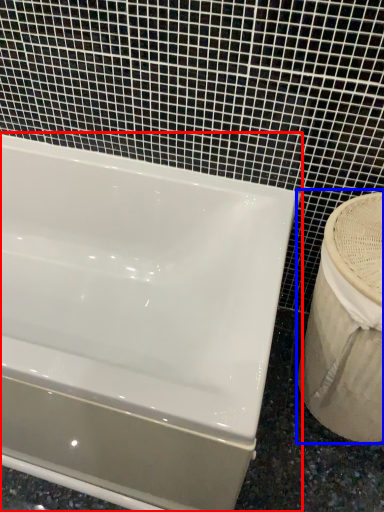
Question: Which object is closer to the camera taking this photo, bathtub (highlighted by a red box) or sink (highlighted by a blue box)?

Choices:
 (A) bathtub
 (B) sink

Answer: (A)